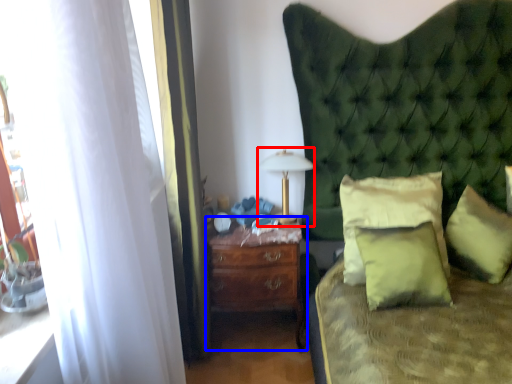
Question: Which of the following is the closest to the observer, bedside lamp (highlighted by a red box) or nightstand (highlighted by a blue box)?

Choices:
 (A) bedside lamp
 (B) nightstand

Answer: (B)